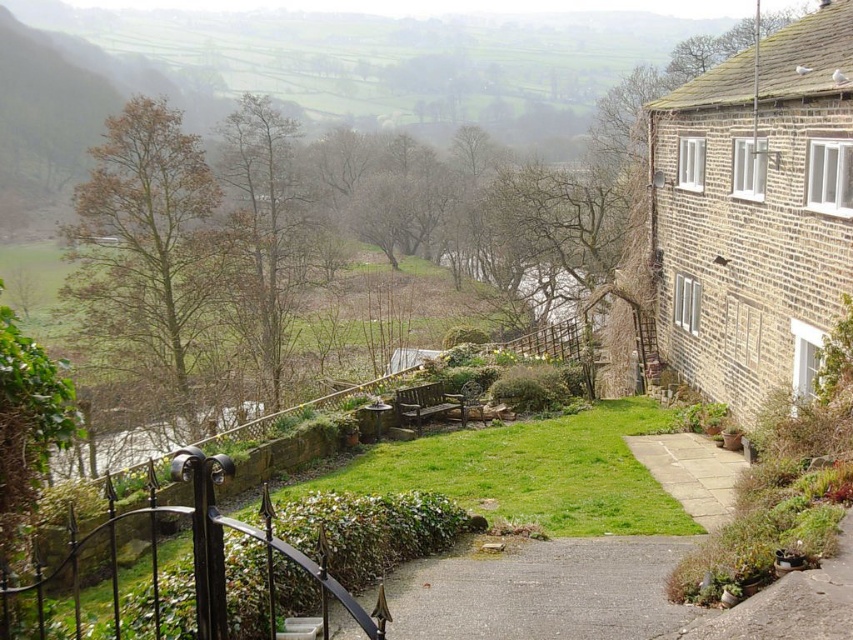
You are a gardener planning to lay new paving stones along the existing paths. The gray gravel path at center and the light gray stone path at center are both in need of repair. If you have paving stones that are 30 cm wide, which path can accommodate them without requiring any adjustments to the stone size?

The gray gravel path at center might be wider than light gray stone path at center, so it can accommodate the 30 cm wide paving stones without adjustments.

You are a gardener planning to water the plants along the paths. Which path, the gray gravel path at center or the light gray stone path at center, is on top of the other one?

The gray gravel path at center is positioned over light gray stone path at center, so the gray gravel path is on top of the light gray stone path.